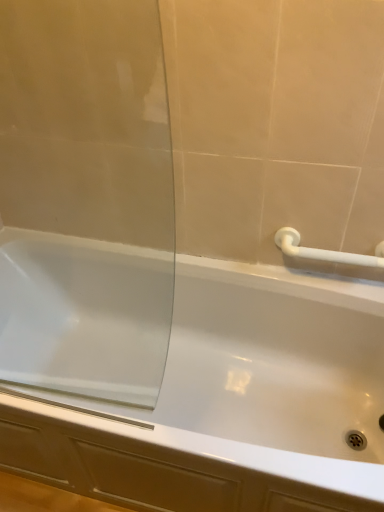
In order to face transparent glass screen door at left, should I rotate leftwards or rightwards?

You should rotate left by 19.083 degrees.

Measure the distance between white glossy bathtub at center and camera.

white glossy bathtub at center and camera are 4.40 feet apart from each other.

The image size is (384, 512). What do you see at coordinates (326, 252) in the screenshot? I see `white plastic towel bar at upper right` at bounding box center [326, 252].

You are a GUI agent. You are given a task and a screenshot of the screen. Output one action in this format:
    pyautogui.click(x=<x>, y=<y>)
    Task: Click on the transparent glass screen door at left
    The width and height of the screenshot is (384, 512).
    Given the screenshot: What is the action you would take?
    pyautogui.click(x=85, y=199)

Can you confirm if white plastic towel bar at upper right is bigger than transparent glass screen door at left?

Actually, white plastic towel bar at upper right might be smaller than transparent glass screen door at left.

Looking at this image, do you think white plastic towel bar at upper right is within transparent glass screen door at left, or outside of it?

white plastic towel bar at upper right cannot be found inside transparent glass screen door at left.

Would you consider white plastic towel bar at upper right to be distant from transparent glass screen door at left?

No, there isn't a large distance between white plastic towel bar at upper right and transparent glass screen door at left.

Can you confirm if white plastic towel bar at upper right is wider than transparent glass screen door at left?

Indeed, white plastic towel bar at upper right has a greater width compared to transparent glass screen door at left.

In the scene shown: From the image's perspective, is white plastic towel bar at upper right on white glossy bathtub at center?

Yes.

Locate an element on the screen. This screenshot has height=512, width=384. bathtub beneath the white plastic towel bar at upper right (from a real-world perspective) is located at coordinates (226, 404).

Would you say white plastic towel bar at upper right is a long distance from white glossy bathtub at center?

No, white plastic towel bar at upper right is in close proximity to white glossy bathtub at center.

From a real-world perspective, who is located higher, white plastic towel bar at upper right or white glossy bathtub at center?

white plastic towel bar at upper right, from a real-world perspective.

Is transparent glass screen door at left in contact with white plastic towel bar at upper right?

transparent glass screen door at left and white plastic towel bar at upper right are not in contact.

Is transparent glass screen door at left to the right of white plastic towel bar at upper right from the viewer's perspective?

No, transparent glass screen door at left is not to the right of white plastic towel bar at upper right.

At what (x,y) coordinates should I click in order to perform the action: click on screen door to the left of white plastic towel bar at upper right. Please return your answer as a coordinate pair (x, y). The width and height of the screenshot is (384, 512). Looking at the image, I should click on (85, 199).

From a real-world perspective, between transparent glass screen door at left and white plastic towel bar at upper right, who is vertically lower?

white plastic towel bar at upper right.

What's the angular difference between white glossy bathtub at center and transparent glass screen door at left's facing directions?

The facing directions of white glossy bathtub at center and transparent glass screen door at left are 0.903 degrees apart.

Considering the relative sizes of white glossy bathtub at center and transparent glass screen door at left in the image provided, is white glossy bathtub at center smaller than transparent glass screen door at left?

Incorrect, white glossy bathtub at center is not smaller in size than transparent glass screen door at left.

Is white glossy bathtub at center not close to transparent glass screen door at left?

Actually, white glossy bathtub at center and transparent glass screen door at left are a little close together.

From a real-world perspective, is white glossy bathtub at center on top of transparent glass screen door at left?

No, from a real-world perspective, white glossy bathtub at center is not over transparent glass screen door at left

From the image's perspective, between transparent glass screen door at left and white glossy bathtub at center, which one is located above?

transparent glass screen door at left appears higher in the image.

Is transparent glass screen door at left facing away from white glossy bathtub at center?

transparent glass screen door at left does not have its back to white glossy bathtub at center.

Consider the image. Measure the distance from transparent glass screen door at left to white glossy bathtub at center.

10.61 inches.

Where is `bathtub that is under the transparent glass screen door at left (from a real-world perspective)`? The height and width of the screenshot is (512, 384). bathtub that is under the transparent glass screen door at left (from a real-world perspective) is located at coordinates (226, 404).

Is white glossy bathtub at center wider or thinner than white plastic towel bar at upper right?

In the image, white glossy bathtub at center appears to be wider than white plastic towel bar at upper right.

Is white glossy bathtub at center far away from white plastic towel bar at upper right?

No, white glossy bathtub at center is not far away from white plastic towel bar at upper right.

Visually, is white glossy bathtub at center positioned to the left or to the right of white plastic towel bar at upper right?

From the image, it's evident that white glossy bathtub at center is to the left of white plastic towel bar at upper right.

You are a GUI agent. You are given a task and a screenshot of the screen. Output one action in this format:
    pyautogui.click(x=<x>, y=<y>)
    Task: Click on the screen door on the left of white plastic towel bar at upper right
    This screenshot has width=384, height=512.
    Given the screenshot: What is the action you would take?
    pyautogui.click(x=85, y=199)

Find the location of `towel bar lying above the white glossy bathtub at center (from the image's perspective)`. towel bar lying above the white glossy bathtub at center (from the image's perspective) is located at coordinates (326, 252).

Based on their spatial positions, is transparent glass screen door at left or white glossy bathtub at center further from white plastic towel bar at upper right?

transparent glass screen door at left lies further to white plastic towel bar at upper right than the other object.

When comparing their distances from white glossy bathtub at center, does white plastic towel bar at upper right or transparent glass screen door at left seem closer?

transparent glass screen door at left is closer to white glossy bathtub at center.

Which object lies further to the anchor point transparent glass screen door at left, white glossy bathtub at center or white plastic towel bar at upper right?

Based on the image, white plastic towel bar at upper right appears to be further to transparent glass screen door at left.

When comparing their distances from white plastic towel bar at upper right, does white glossy bathtub at center or transparent glass screen door at left seem further?

The object further to white plastic towel bar at upper right is transparent glass screen door at left.

From the image, which object appears to be farther from white glossy bathtub at center, transparent glass screen door at left or white plastic towel bar at upper right?

white plastic towel bar at upper right lies further to white glossy bathtub at center than the other object.

Based on their spatial positions, is white plastic towel bar at upper right or white glossy bathtub at center closer to transparent glass screen door at left?

white glossy bathtub at center lies closer to transparent glass screen door at left than the other object.

I want to click on bathtub between transparent glass screen door at left and white plastic towel bar at upper right along the z-axis, so click(226, 404).